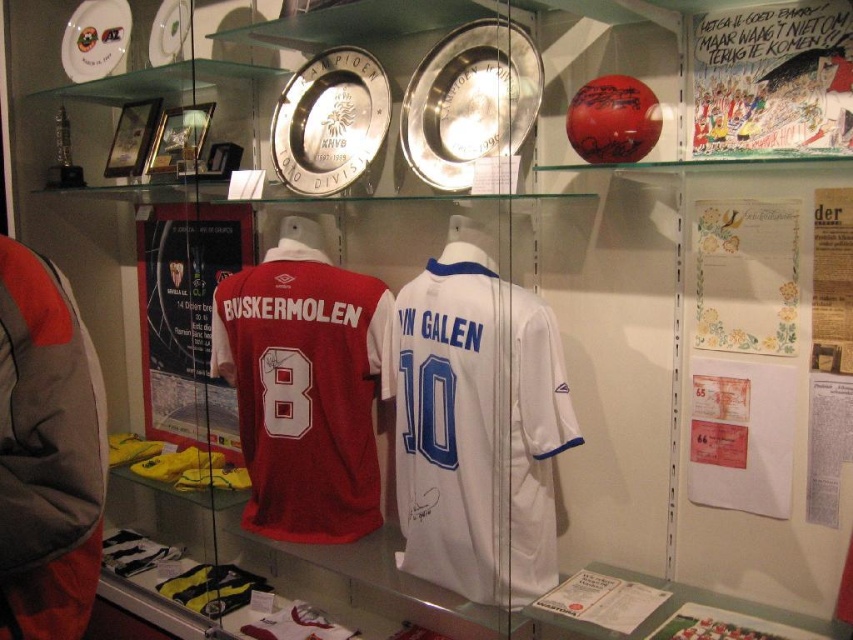
Which of these two, matte jersey at center or white fabric jersey at center, stands taller?

matte jersey at center is taller.

Is matte jersey at center below white fabric jersey at center?

No.

This screenshot has width=853, height=640. In order to click on matte jersey at center in this screenshot , I will do `click(303, 390)`.

I want to click on matte jersey at center, so click(x=303, y=390).

Based on the photo, between matte jersey at center and brushed metal baseball uniform at left, which one appears on the left side from the viewer's perspective?

brushed metal baseball uniform at left

This screenshot has width=853, height=640. Describe the element at coordinates (303, 390) in the screenshot. I see `matte jersey at center` at that location.

Identify the location of matte jersey at center. (303, 390).

What do you see at coordinates (476, 428) in the screenshot? I see `white jersey at center` at bounding box center [476, 428].

Does point (454, 273) lie in front of point (445, 376)?

No, it is behind (445, 376).

Which is in front, point (448, 525) or point (410, 381)?

Point (448, 525) is more forward.

You are a GUI agent. You are given a task and a screenshot of the screen. Output one action in this format:
    pyautogui.click(x=<x>, y=<y>)
    Task: Click on the white jersey at center
    
    Given the screenshot: What is the action you would take?
    pyautogui.click(x=476, y=428)